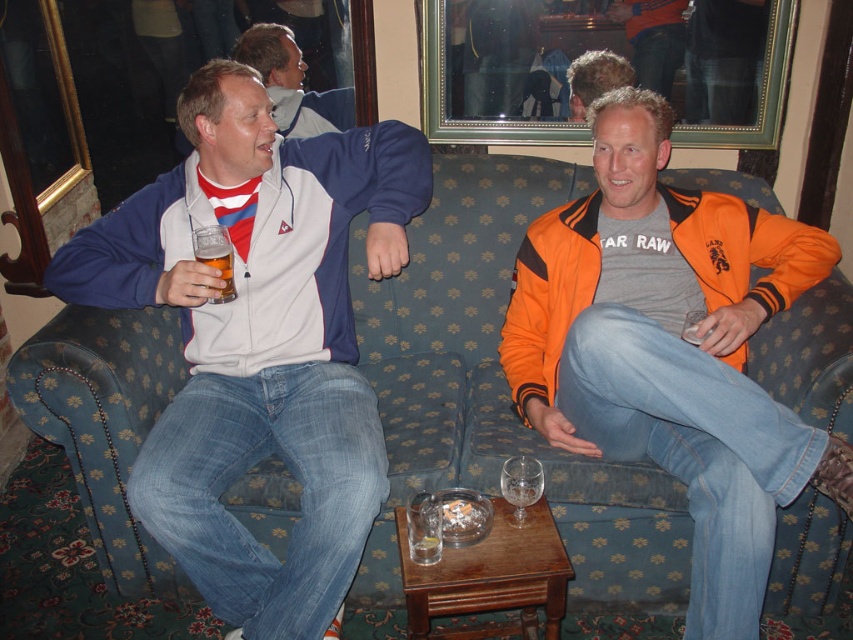
You are a delivery robot with a height of 1.5 meters. You are entering a room and see the blue fabric couch at center. Can you safely pass under the couch without hitting your head?

The distance between the blue fabric couch at center and the camera is 1.65 meters. Since the robot is 1.5 meters tall, it can safely pass under the couch as the clearance is sufficient.

You are standing in a room and want to reach the blue fabric couch at center. There is a matte blue jacket at left in your way. Which object should you move first to get to the couch?

The matte blue jacket at left is closer to you than the blue fabric couch at center, so you should move the matte blue jacket at left first to reach the couch.